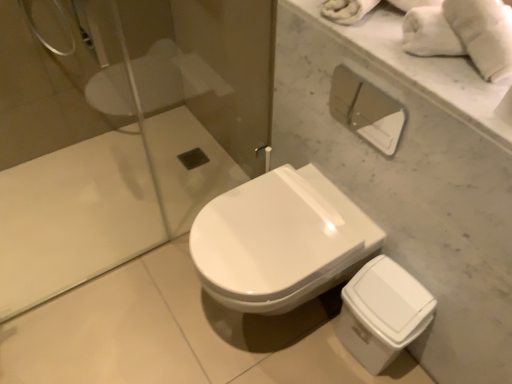
Where is `vacant point above white glossy toilet at center (from a real-world perspective)`? Image resolution: width=512 pixels, height=384 pixels. vacant point above white glossy toilet at center (from a real-world perspective) is located at coordinates (264, 227).